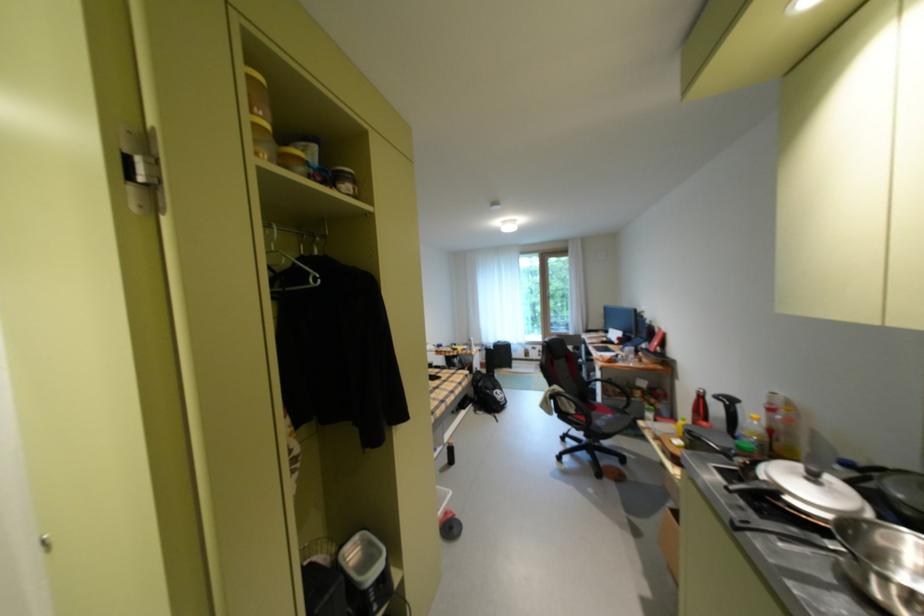
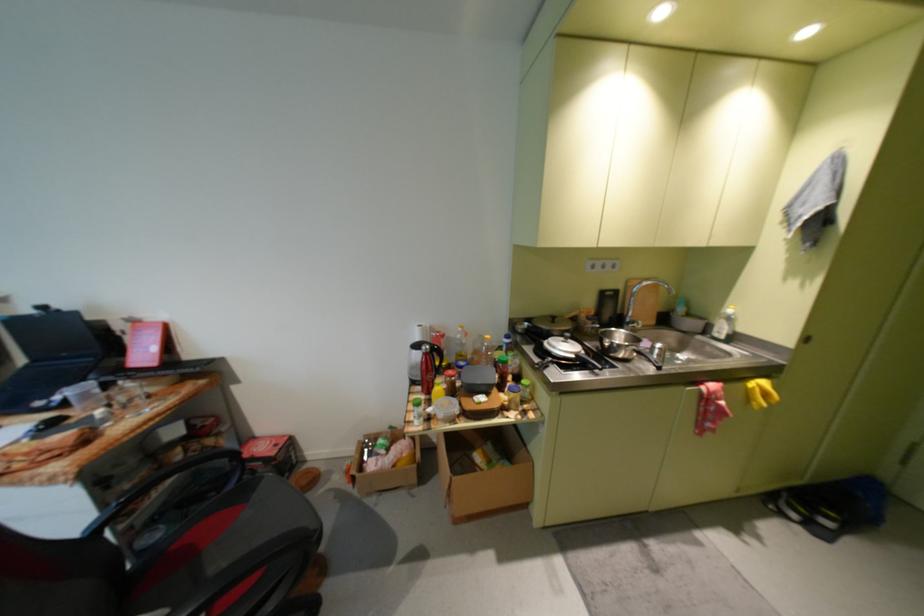
Locate, in the second image, the point that corresponds to [711,402] in the first image.

(439, 358)